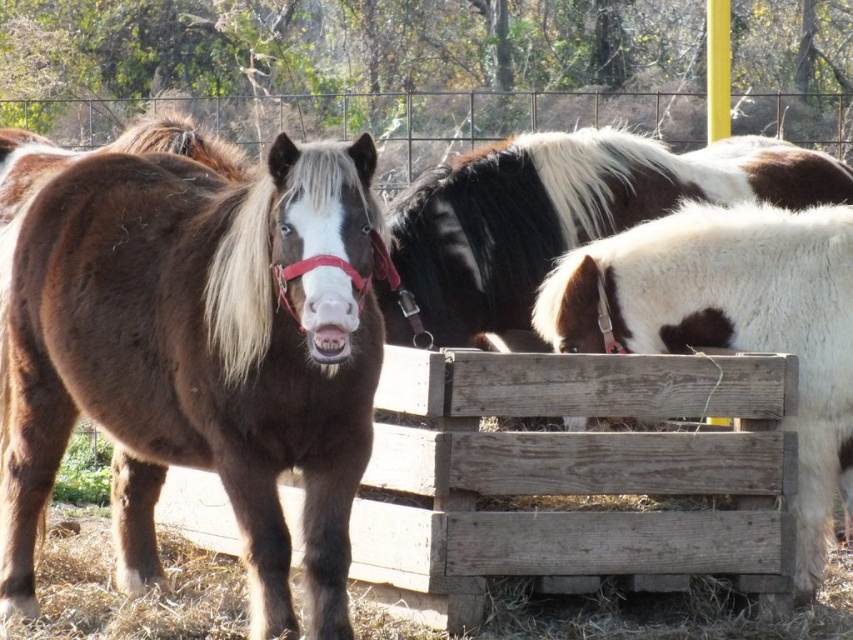
Question: Can you confirm if white speckled wood at right is positioned above white-spotted fur horse at center?

Choices:
 (A) no
 (B) yes

Answer: (A)

Question: Is white speckled wood at right in front of white-spotted fur horse at center?

Choices:
 (A) no
 (B) yes

Answer: (B)

Question: Which of the following is the closest to the observer?

Choices:
 (A) (801, 289)
 (B) (219, 461)
 (C) (769, 172)

Answer: (B)

Question: Among these points, which one is nearest to the camera?

Choices:
 (A) (741, 204)
 (B) (532, 301)
 (C) (132, 180)

Answer: (C)

Question: Is brown shaggy pony at center to the right of white-spotted fur horse at center from the viewer's perspective?

Choices:
 (A) yes
 (B) no

Answer: (B)

Question: Which point is closer to the camera taking this photo?

Choices:
 (A) (639, 148)
 (B) (845, 456)

Answer: (B)